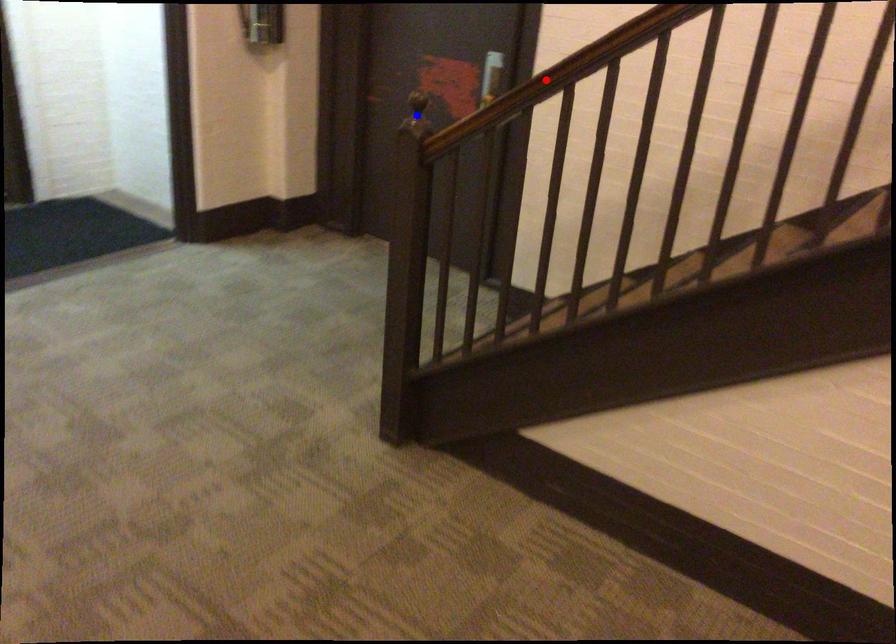
Question: Which of the two points in the image is closer to the camera?

Choices:
 (A) Blue point is closer.
 (B) Red point is closer.

Answer: (B)